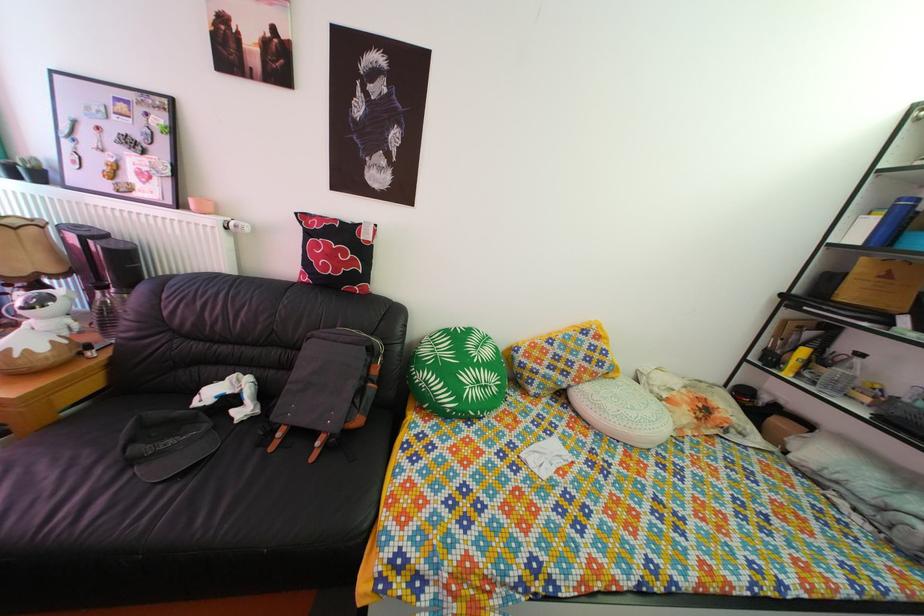
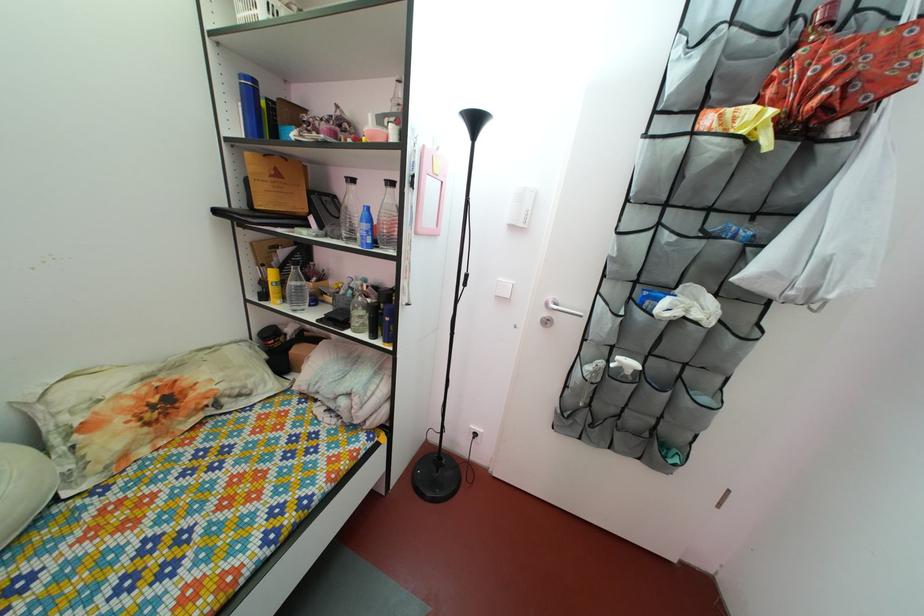
Where in the second image is the point corresponding to the point at 818,342 from the first image?

(292, 262)